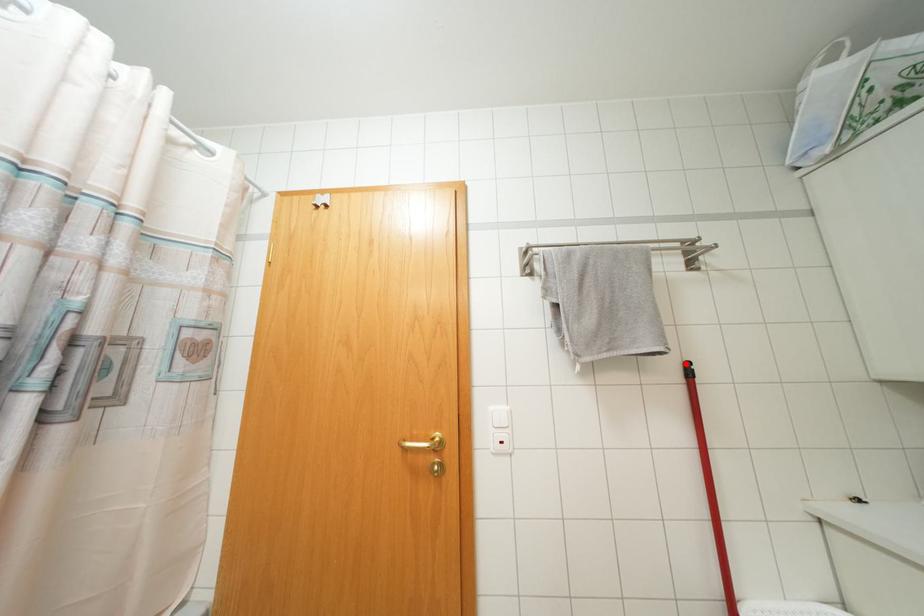
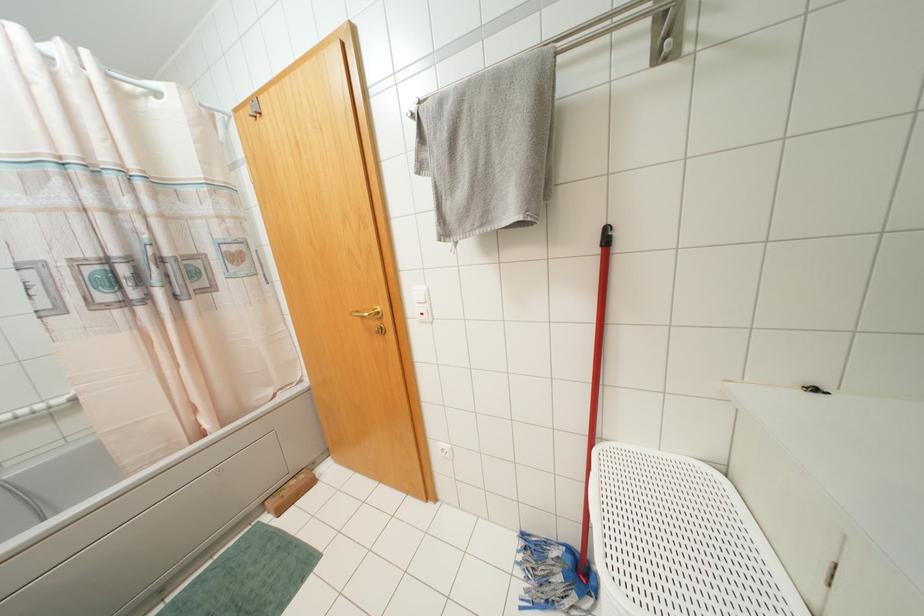
Find the pixel in the second image that matches the highlighted location in the first image.

(606, 229)